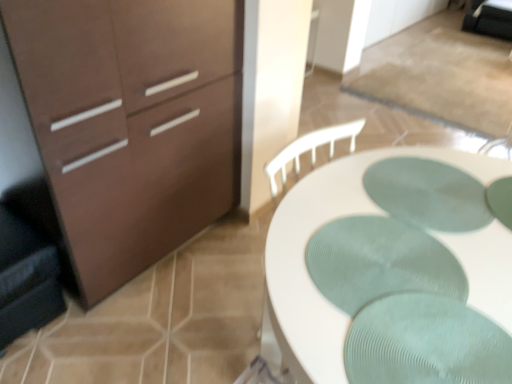
Find the location of a particular element. free space in front of green ribbed placemat at center, the second oval from the top is located at coordinates (401, 355).